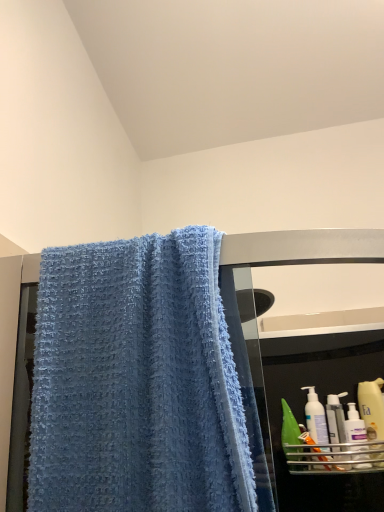
Question: Should I look upward or downward to see white plastic bottle at lower right, marked as the second cleaning product in a left-to-right arrangement?

Choices:
 (A) down
 (B) up

Answer: (A)

Question: Considering the relative positions of green matte bottle at right, the first mouthwash when ordered from left to right, and white plastic bottle at lower right, marked as the second cleaning product in a left-to-right arrangement, in the image provided, is green matte bottle at right, the first mouthwash when ordered from left to right, to the left of white plastic bottle at lower right, marked as the second cleaning product in a left-to-right arrangement, from the viewer's perspective?

Choices:
 (A) yes
 (B) no

Answer: (A)

Question: Is green matte bottle at right, the first mouthwash when ordered from left to right, looking in the opposite direction of white plastic bottle at lower right, the second cleaning product when ordered from right to left?

Choices:
 (A) yes
 (B) no

Answer: (B)

Question: Can you confirm if green matte bottle at right, the first mouthwash when ordered from left to right, is wider than white plastic bottle at lower right, marked as the second cleaning product in a left-to-right arrangement?

Choices:
 (A) yes
 (B) no

Answer: (B)

Question: Are green matte bottle at right, which is the 2th mouthwash in right-to-left order, and white plastic bottle at lower right, the second cleaning product when ordered from right to left, beside each other?

Choices:
 (A) yes
 (B) no

Answer: (B)

Question: Considering the relative sizes of green matte bottle at right, the first mouthwash when ordered from left to right, and white plastic bottle at lower right, the second cleaning product when ordered from right to left, in the image provided, is green matte bottle at right, the first mouthwash when ordered from left to right, taller than white plastic bottle at lower right, the second cleaning product when ordered from right to left,?

Choices:
 (A) yes
 (B) no

Answer: (A)

Question: From the image's perspective, would you say green matte bottle at right, which is the 2th mouthwash in right-to-left order, is positioned over white plastic bottle at lower right, marked as the second cleaning product in a left-to-right arrangement?

Choices:
 (A) yes
 (B) no

Answer: (B)

Question: Are green matte bottle at right, the first mouthwash when ordered from left to right, and blue textured towel at upper left making contact?

Choices:
 (A) no
 (B) yes

Answer: (A)

Question: Is blue textured towel at upper left at the back of green matte bottle at right, the first mouthwash when ordered from left to right?

Choices:
 (A) no
 (B) yes

Answer: (A)

Question: Is green matte bottle at right, the first mouthwash when ordered from left to right, to the right of blue textured towel at upper left from the viewer's perspective?

Choices:
 (A) no
 (B) yes

Answer: (B)

Question: Is green matte bottle at right, the first mouthwash when ordered from left to right, taller than blue textured towel at upper left?

Choices:
 (A) no
 (B) yes

Answer: (A)

Question: Is green matte bottle at right, which is the 2th mouthwash in right-to-left order, outside blue textured towel at upper left?

Choices:
 (A) yes
 (B) no

Answer: (A)

Question: Does green matte bottle at right, the first mouthwash when ordered from left to right, have a greater width compared to blue textured towel at upper left?

Choices:
 (A) no
 (B) yes

Answer: (A)

Question: Could you tell me if white plastic bottle at right, placed as the first mouthwash when sorted from right to left, is facing white plastic pump bottle at right, acting as the 1th cleaning product starting from the left?

Choices:
 (A) yes
 (B) no

Answer: (B)